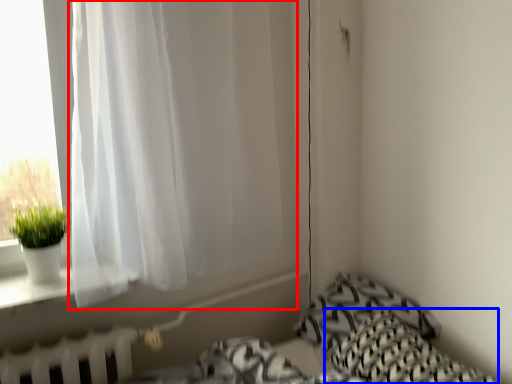
Question: Which of the following is the closest to the observer, curtain (highlighted by a red box) or pillow (highlighted by a blue box)?

Choices:
 (A) curtain
 (B) pillow

Answer: (B)